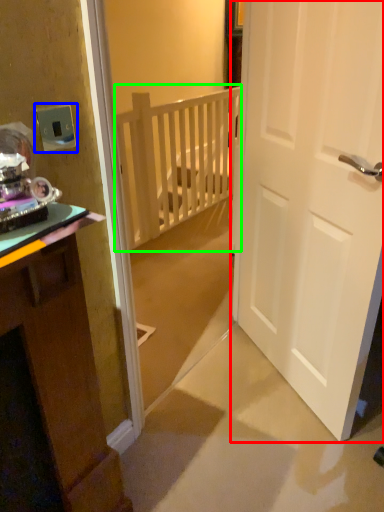
Question: Considering the real-world distances, which object is closest to door (highlighted by a red box)? electric outlet (highlighted by a blue box) or balustrade (highlighted by a green box).

Choices:
 (A) electric outlet
 (B) balustrade

Answer: (A)